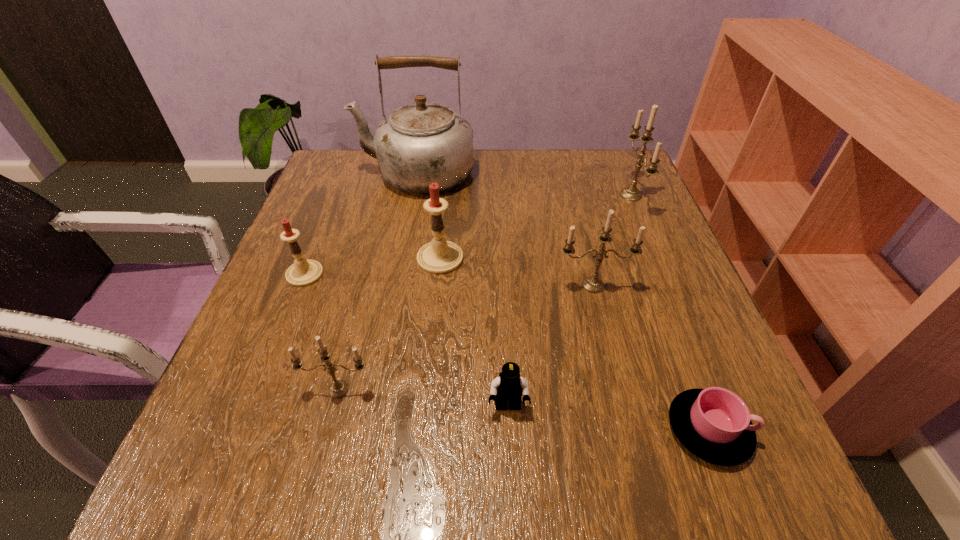
Locate an element on the screen. The width and height of the screenshot is (960, 540). unoccupied area between the leftmost candle and the fourth object from right to left is located at coordinates (406, 340).

Where is `empty space that is in between the third candle from right to left and the second biggest metallic candle`? empty space that is in between the third candle from right to left and the second biggest metallic candle is located at coordinates (516, 272).

Identify the location of vacant region between the right red candle and the black Lego. (474, 333).

The height and width of the screenshot is (540, 960). In order to click on vacant area that lies between the fifth object from left to right and the pink cup in this screenshot , I will do `click(609, 418)`.

Locate an element on the screen. The image size is (960, 540). object identified as the second closest to the leftmost candle is located at coordinates (x=339, y=388).

I want to click on object that stands as the closest to the left red candle, so click(439, 256).

Identify the location of candle object that ranks as the fourth closest to the pink cup. This screenshot has width=960, height=540. (631, 193).

Where is `candle that is the closest to the smaller red candle`? candle that is the closest to the smaller red candle is located at coordinates (439, 256).

Point out which metallic candle is positioned as the third nearest to the pink cup. Please provide its 2D coordinates. Your answer should be formatted as a tuple, i.e. [(x, y)], where the tuple contains the x and y coordinates of a point satisfying the conditions above.

[(631, 193)]

Where is `the third closest metallic candle to the right red candle`? The height and width of the screenshot is (540, 960). the third closest metallic candle to the right red candle is located at coordinates (631, 193).